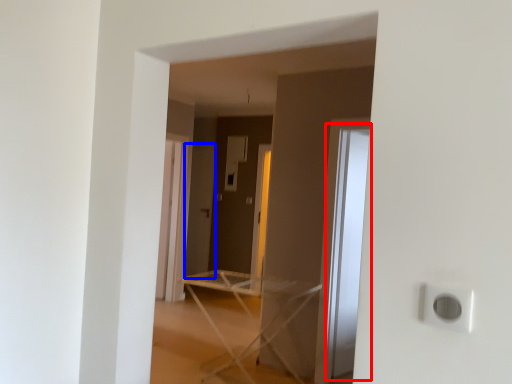
Question: Which object is further to the camera taking this photo, glass door (highlighted by a red box) or screen door (highlighted by a blue box)?

Choices:
 (A) glass door
 (B) screen door

Answer: (B)